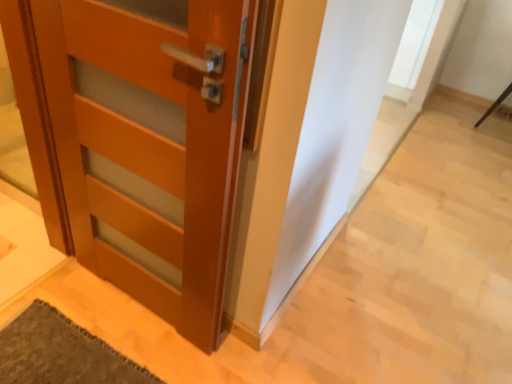
Where is `vacant space to the left of matte wood door at left`? vacant space to the left of matte wood door at left is located at coordinates (75, 312).